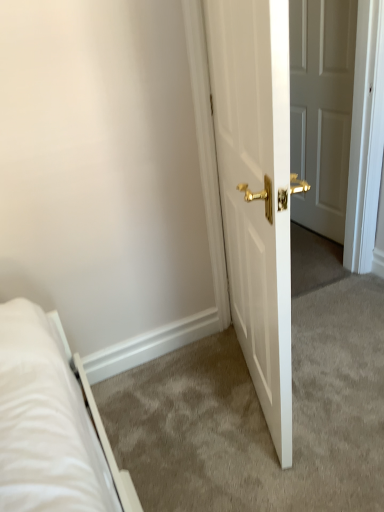
What do you see at coordinates (321, 109) in the screenshot? This screenshot has width=384, height=512. I see `white matte door at center` at bounding box center [321, 109].

Find the location of a particular element. The width and height of the screenshot is (384, 512). white matte door at center is located at coordinates (321, 109).

Where is `white matte door at center`? The height and width of the screenshot is (512, 384). white matte door at center is located at coordinates (321, 109).